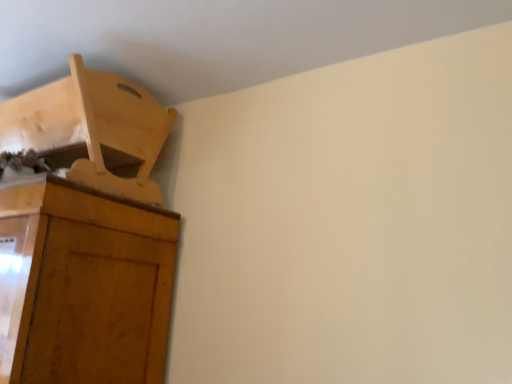
Question: Is light wood chair at upper left turned away from wooden cupboard at upper left?

Choices:
 (A) yes
 (B) no

Answer: (B)

Question: Is light wood chair at upper left next to wooden cupboard at upper left?

Choices:
 (A) yes
 (B) no

Answer: (B)

Question: From the image's perspective, is light wood chair at upper left below wooden cupboard at upper left?

Choices:
 (A) no
 (B) yes

Answer: (A)

Question: Is light wood chair at upper left bigger than wooden cupboard at upper left?

Choices:
 (A) no
 (B) yes

Answer: (A)

Question: Does light wood chair at upper left come in front of wooden cupboard at upper left?

Choices:
 (A) yes
 (B) no

Answer: (B)

Question: Considering the relative positions of light wood chair at upper left and wooden cupboard at upper left in the image provided, is light wood chair at upper left to the left of wooden cupboard at upper left from the viewer's perspective?

Choices:
 (A) no
 (B) yes

Answer: (A)

Question: Is wooden cupboard at upper left aimed at light wood chair at upper left?

Choices:
 (A) yes
 (B) no

Answer: (B)

Question: Can we say wooden cupboard at upper left lies outside light wood chair at upper left?

Choices:
 (A) yes
 (B) no

Answer: (A)

Question: Considering the relative sizes of wooden cupboard at upper left and light wood chair at upper left in the image provided, is wooden cupboard at upper left wider than light wood chair at upper left?

Choices:
 (A) no
 (B) yes

Answer: (B)

Question: Can you confirm if wooden cupboard at upper left is bigger than light wood chair at upper left?

Choices:
 (A) yes
 (B) no

Answer: (A)

Question: Can you confirm if wooden cupboard at upper left is smaller than light wood chair at upper left?

Choices:
 (A) no
 (B) yes

Answer: (A)

Question: Considering the relative sizes of wooden cupboard at upper left and light wood chair at upper left in the image provided, is wooden cupboard at upper left thinner than light wood chair at upper left?

Choices:
 (A) no
 (B) yes

Answer: (A)

Question: From the image's perspective, is wooden cupboard at upper left located above or below light wood chair at upper left?

Choices:
 (A) above
 (B) below

Answer: (B)